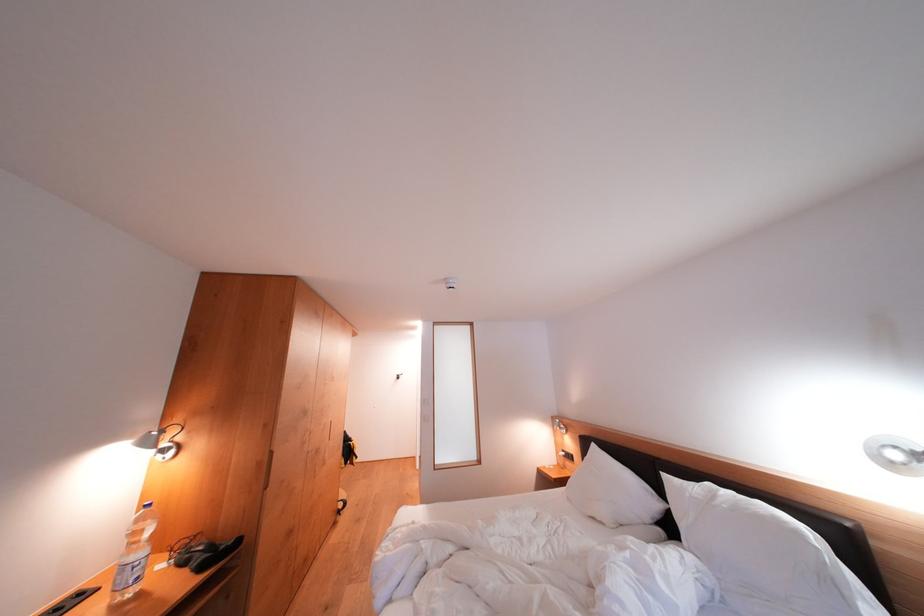
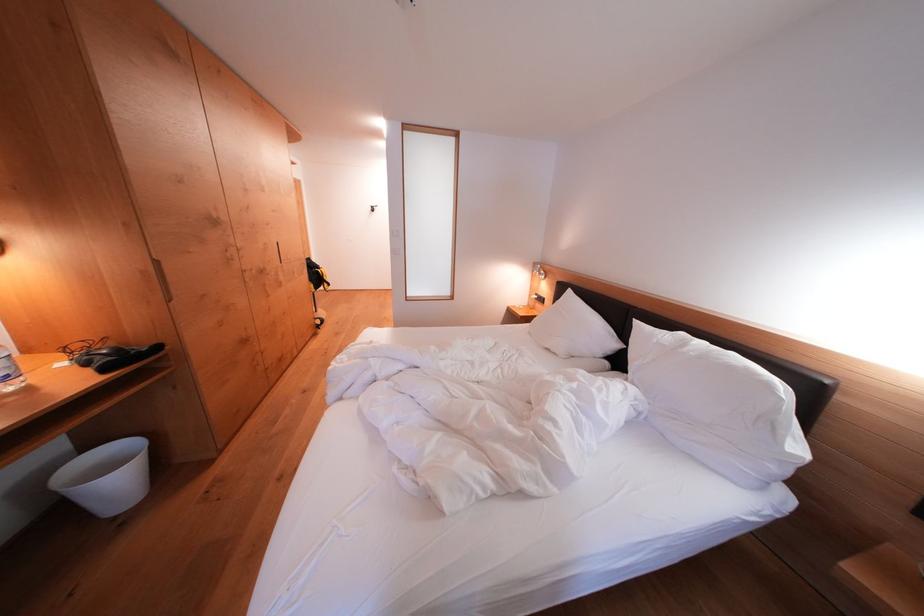
Find the pixel in the second image that matches pixel 273 464 in the first image.

(159, 274)